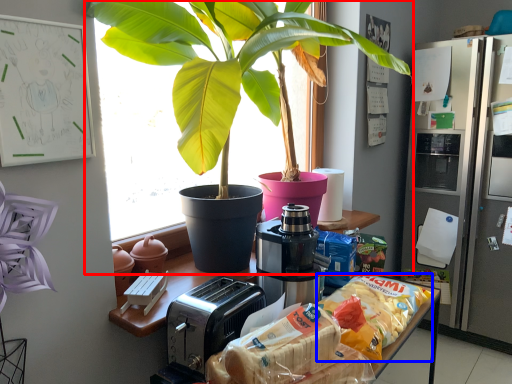
Question: Which object is further to the camera taking this photo, houseplant (highlighted by a red box) or snack (highlighted by a blue box)?

Choices:
 (A) houseplant
 (B) snack

Answer: (B)